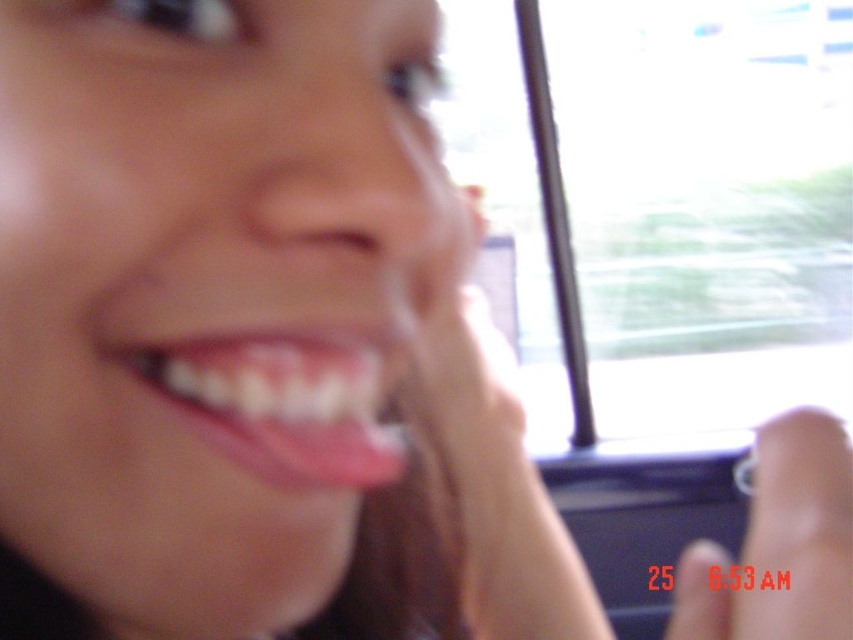
You are a dental professional examining a patient in a vehicle. You notice the white glossy teeth at center and the clear plastic finger at center. Which object is shorter?

The white glossy teeth at center is shorter than the clear plastic finger at center.

You are a photographer trying to capture a closeup of a person in a car. You notice the smooth skin face at center and the white glossy teeth at center. Based on their sizes, which one would you focus on to ensure the subject is prominent in the photo?

The smooth skin face at center has a larger width than the white glossy teeth at center, so focusing on the smooth skin face at center would make the subject more prominent in the photo.